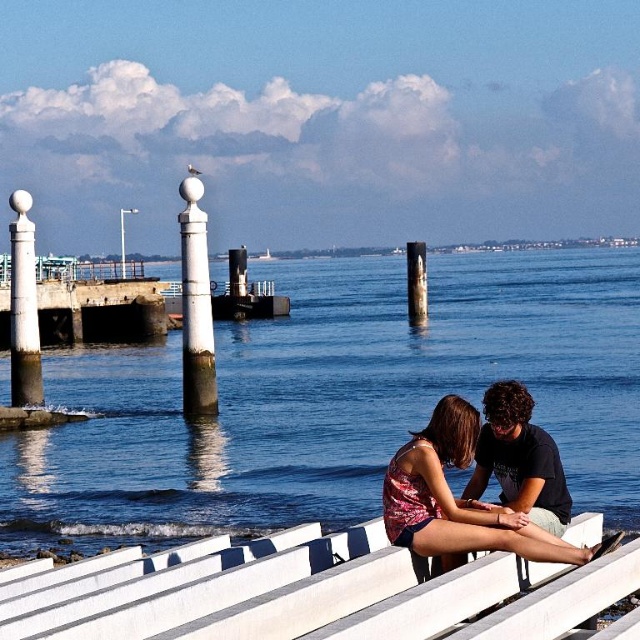
You are standing at the wooden bench in the coastal scene. You see two points marked on the ground. The first point is at location point (x=528, y=419) and the second point is at point (x=419, y=259). Which point is closer to you?

Point (x=528, y=419) is in front of point (x=419, y=259), so it is closer to you.